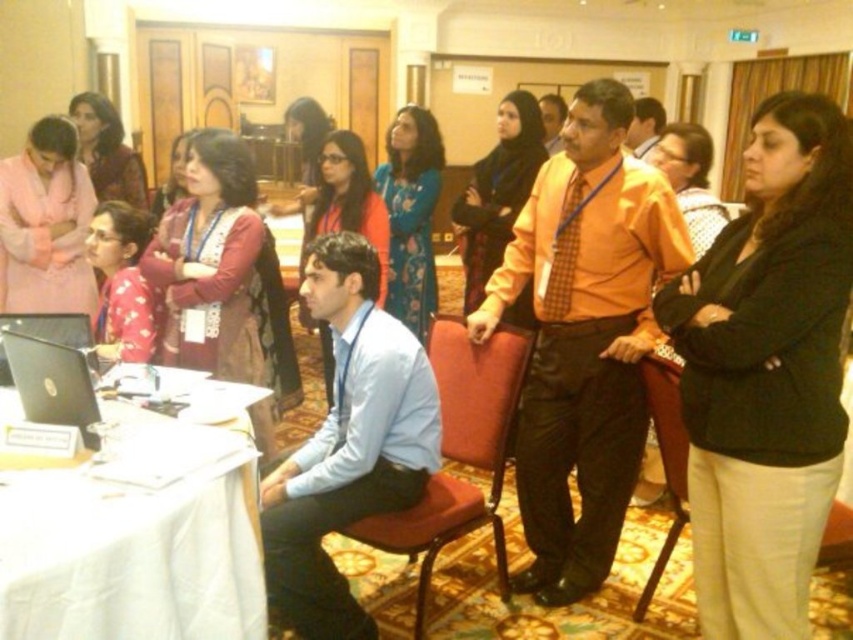
Looking at this image, you are standing at the entrance of the conference room and see two points marked in the scene. The first point is at coordinates point [802,196] and the second is at point [460,509]. Which point is closer to you?

Point [802,196] is in front of point [460,509], so the first point is closer to you.

You are a service robot that is 28 inches wide. You need to move from the entrance to the back of the room. There is a black matte blazer at center and a red fabric chair at center in your path. Can you pass between them without touching either?

The distance between the black matte blazer at center and the red fabric chair at center is 30.20 inches. Since the robot is 28 inches wide, it can pass through the space between them without touching either object.